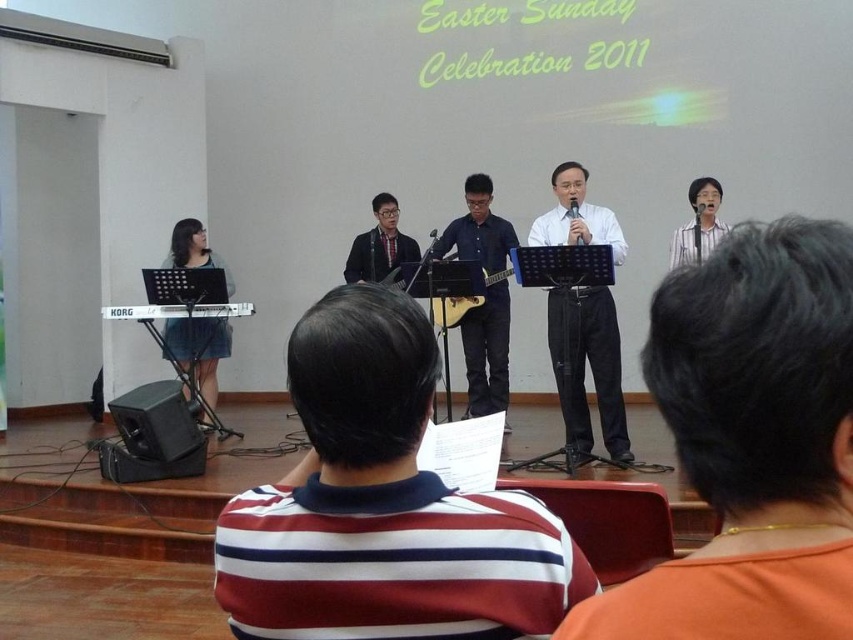
From the picture: You are attending the Easter Sunday performance and notice the white smooth shirt at center and the blue matte guitar at center on stage. Which object is closer to the ground?

The white smooth shirt at center is shorter than the blue matte guitar at center, so the white smooth shirt at center is closer to the ground.

You are a photographer positioned at the back of the stage. You want to capture a clear shot of the blue matte guitar at center without the orange fabric at upper right blocking it. What should you do?

The orange fabric at upper right is in front of the blue matte guitar at center, so to avoid the orange fabric blocking the view, you should move your position to the left side of the stage where the orange fabric is no longer in front of the guitar.

You are attending the Easter Sunday performance and notice two items on stage. The first is the orange fabric at upper right, and the second is the white smooth shirt at center. Which of these two items is shorter in height?

The orange fabric at upper right has a lesser height compared to the white smooth shirt at center, so the orange fabric at upper right is shorter in height.